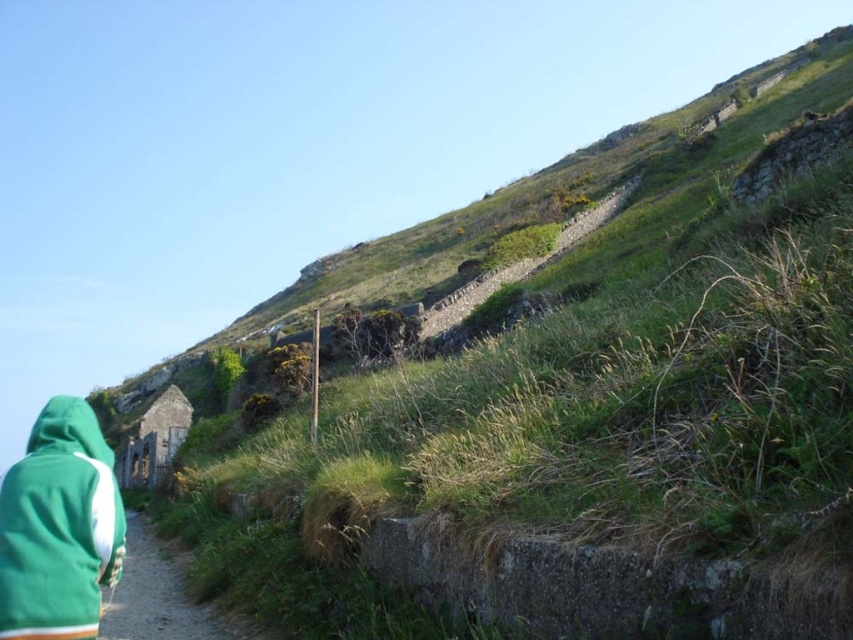
You are hiking on a steep path in the countryside and notice two items at the lower left of your view. They are the green fleece sweatshirt at lower left and the green fabric at lower left. Which item appears taller in the scene?

The green fleece sweatshirt at lower left appears much taller than the green fabric at lower left according to the description.

You are standing at point A and want to walk to point B. The coordinates of point A are point A at (57, 628). The coordinates of point B are point B at 0.016, 0.932. The path between them is 34.27 meters long. Considering the steep and uneven terrain, do you think it will take you more than 5 minutes to walk from point A to point B?

The path between point A at (57, 628) and point B at 0.016, 0.932 is 34.27 meters long. Given the steep and uneven terrain described in the scene, it would likely take more than 5 minutes to walk this distance.

You are a hiker who has just started walking along the narrow dirt path bordered by low stone walls. You notice two items at the lower left of your view. One is a green fleece sweatshirt at lower left and the other is a green fabric at lower left. Which item is positioned more to the right?

The green fleece sweatshirt at lower left is to the right of green fabric at lower left.